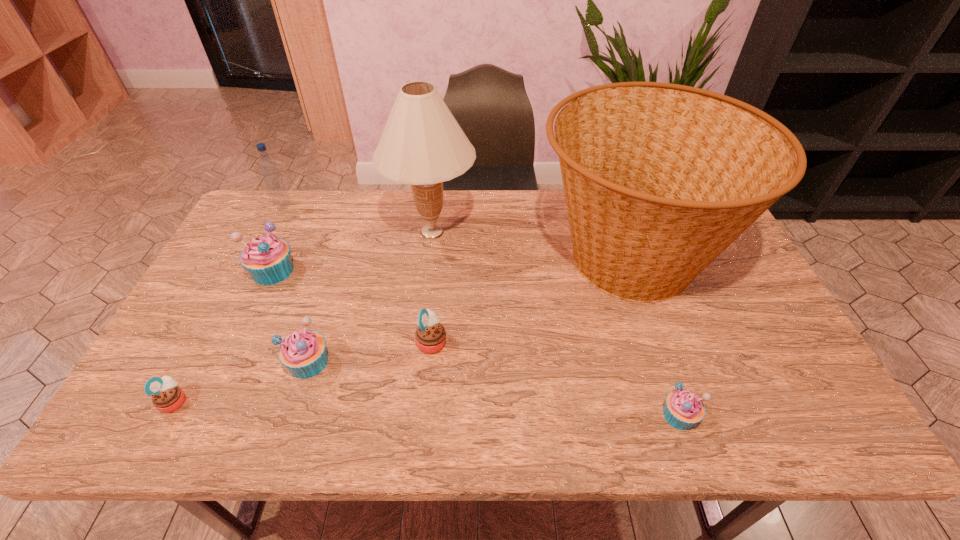
Locate an element on the screen. Image resolution: width=960 pixels, height=540 pixels. vacant space at the far edge of the desktop is located at coordinates (450, 192).

Identify the location of vacant area at the near edge. This screenshot has height=540, width=960. (577, 440).

Image resolution: width=960 pixels, height=540 pixels. In the image, there is a desktop. What are the coordinates of `free space at the left edge` in the screenshot? It's located at (217, 320).

Locate an element on the screen. This screenshot has width=960, height=540. free region at the far left corner of the desktop is located at coordinates (256, 232).

The height and width of the screenshot is (540, 960). Identify the location of empty space between the smallest blue muffin and the right pink muffin. (556, 378).

The width and height of the screenshot is (960, 540). I want to click on free space between the beige lampshade and the farther pink muffin, so click(432, 286).

Where is `free space between the smaller pink muffin and the water bottle`? This screenshot has width=960, height=540. free space between the smaller pink muffin and the water bottle is located at coordinates (229, 303).

The height and width of the screenshot is (540, 960). Find the location of `empty space between the rightmost blue muffin and the fifth shortest object`. empty space between the rightmost blue muffin and the fifth shortest object is located at coordinates (476, 343).

Find the location of a particular element. Image resolution: width=960 pixels, height=540 pixels. vacant area that lies between the farther pink muffin and the farthest muffin is located at coordinates (352, 306).

Where is `free space between the lampshade and the smaller pink muffin`? This screenshot has height=540, width=960. free space between the lampshade and the smaller pink muffin is located at coordinates (303, 316).